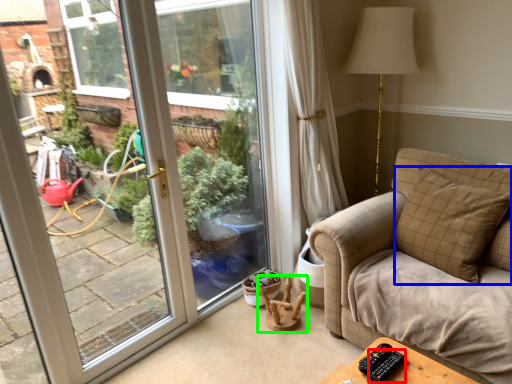
Question: Which object is positioned closest to remote (highlighted by a red box)? Select from pillow (highlighted by a blue box) and rocking chair (highlighted by a green box).

Choices:
 (A) pillow
 (B) rocking chair

Answer: (A)